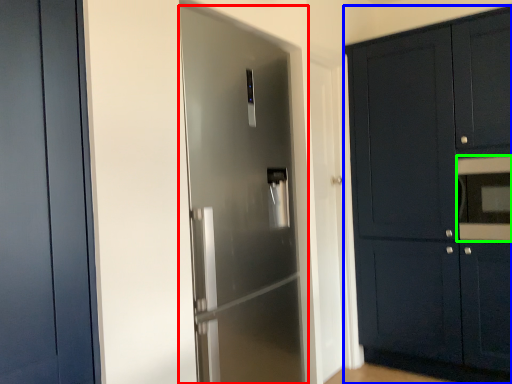
Question: Based on their relative distances, which object is nearer to door (highlighted by a red box)? Choose from cabinetry (highlighted by a blue box) and oven (highlighted by a green box).

Choices:
 (A) cabinetry
 (B) oven

Answer: (A)